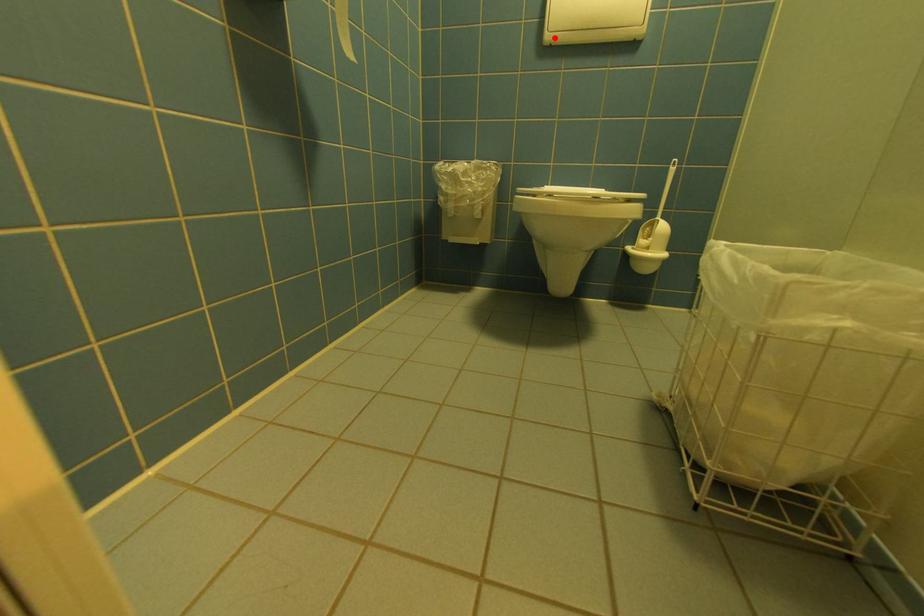
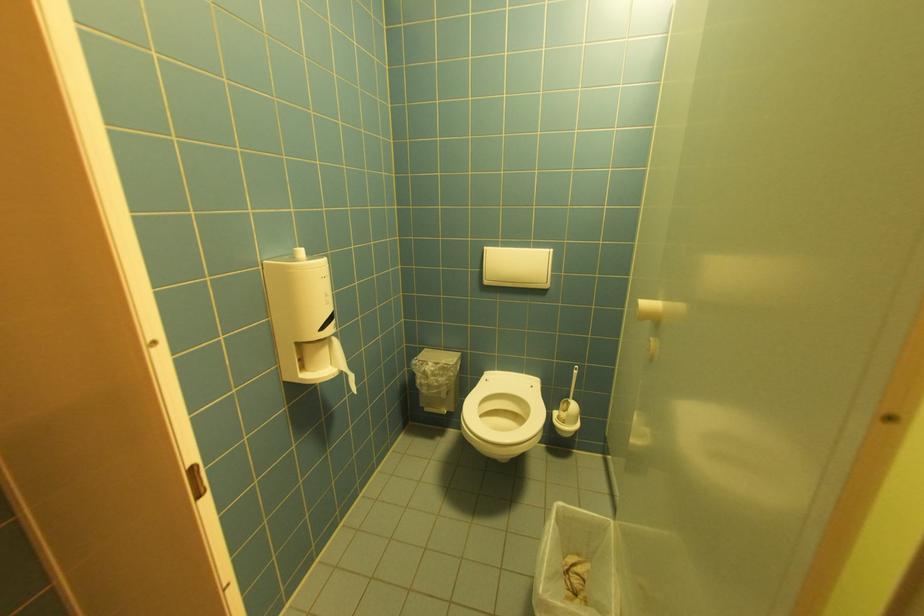
Where in the second image is the point corresponding to the highlighted location from the first image?

(492, 283)